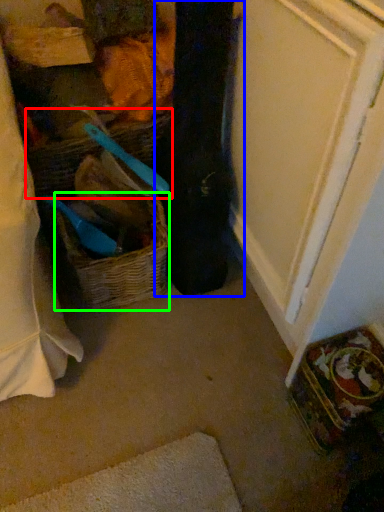
Question: Which object is positioned closest to basket (highlighted by a red box)? Select from clothing (highlighted by a blue box) and picnic basket (highlighted by a green box).

Choices:
 (A) clothing
 (B) picnic basket

Answer: (B)